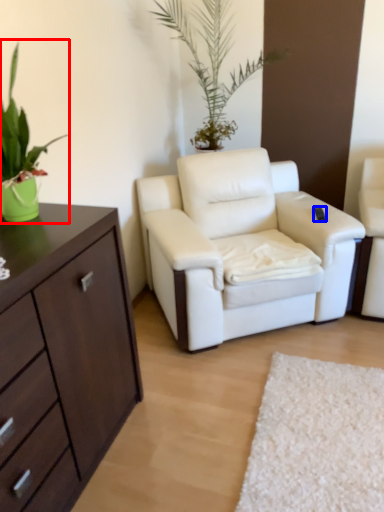
Question: Among these objects, which one is farthest to the camera, houseplant (highlighted by a red box) or remote control (highlighted by a blue box)?

Choices:
 (A) houseplant
 (B) remote control

Answer: (B)